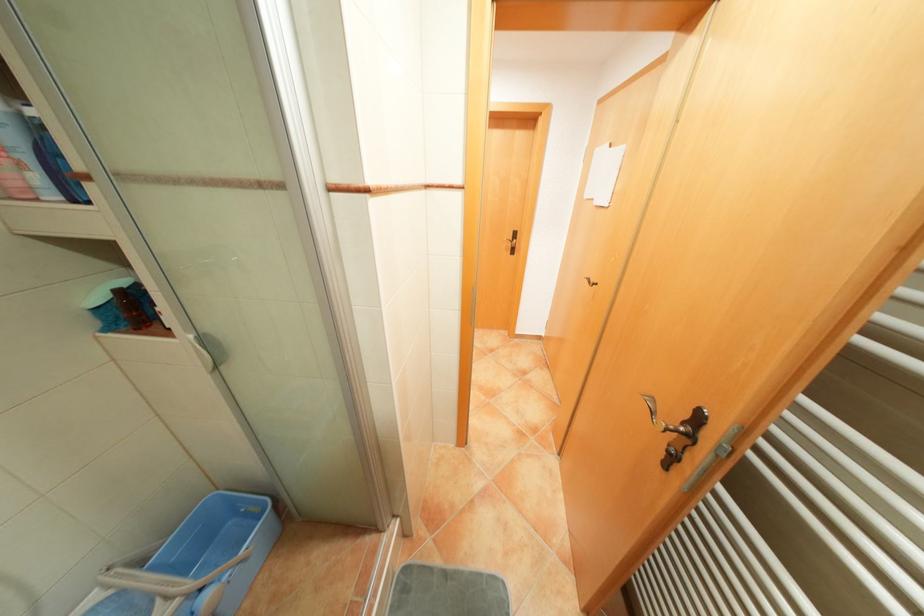
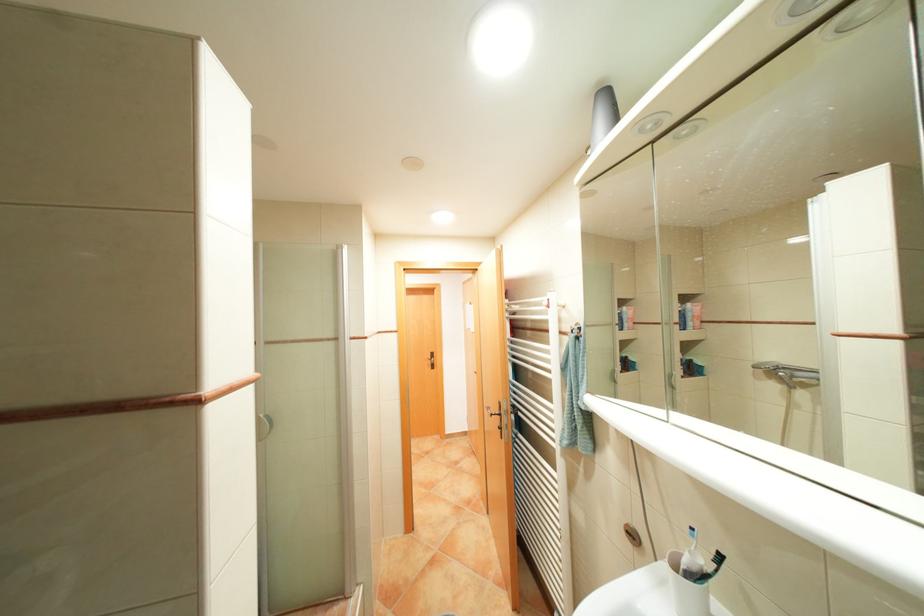
Find the pixel in the second image that matches (x=700, y=437) in the first image.

(509, 413)